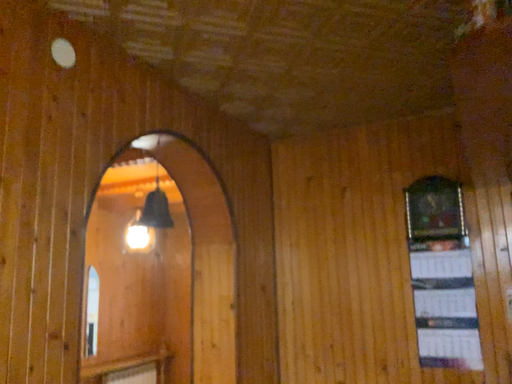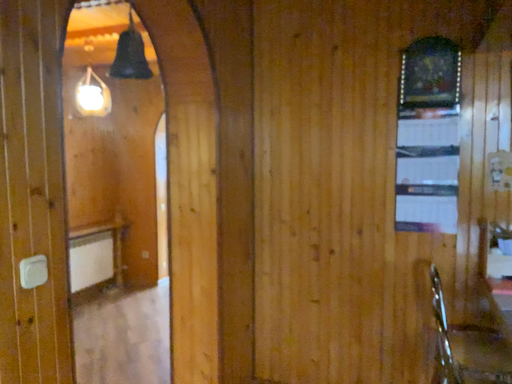
Question: How did the camera likely rotate when shooting the video?

Choices:
 (A) rotated upward
 (B) rotated downward

Answer: (B)